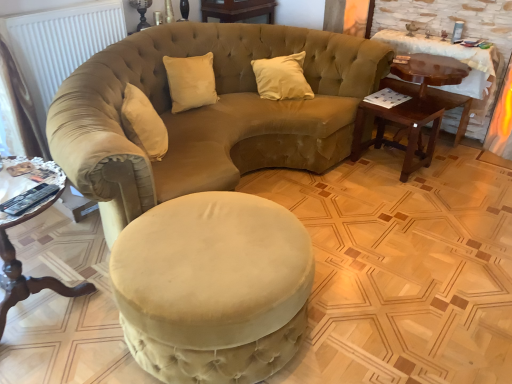
What do you see at coordinates (409, 122) in the screenshot? I see `dark brown wood side table at right, which appears as the 2th table when viewed from the back` at bounding box center [409, 122].

Locate an element on the screen. This screenshot has width=512, height=384. wooden round table at lower left, the 3th table from the back is located at coordinates (13, 246).

Image resolution: width=512 pixels, height=384 pixels. Identify the location of velvet beige studio couch at center. (208, 112).

This screenshot has width=512, height=384. What do you see at coordinates (208, 112) in the screenshot?
I see `velvet beige studio couch at center` at bounding box center [208, 112].

Identify the location of velvet beige ottoman at center. The width and height of the screenshot is (512, 384). (213, 287).

Would you say beige velvet pillow at center is outside velvet beige ottoman at center?

Indeed, beige velvet pillow at center is completely outside velvet beige ottoman at center.

Considering the relative sizes of beige velvet pillow at center and velvet beige ottoman at center in the image provided, is beige velvet pillow at center shorter than velvet beige ottoman at center?

Correct, beige velvet pillow at center is not as tall as velvet beige ottoman at center.

Is point (267, 94) in front of point (173, 218)?

No.

Can you tell me how much beige velvet pillow at center and velvet beige ottoman at center differ in facing direction?

144 degrees.

From a real-world perspective, which is physically below, white matte radiator at upper left or beige velvet pillow at center?

From a 3D spatial view, beige velvet pillow at center is below.

Which object is thinner, white matte radiator at upper left or beige velvet pillow at center?

With smaller width is white matte radiator at upper left.

Considering the relative sizes of white matte radiator at upper left and beige velvet pillow at center in the image provided, is white matte radiator at upper left smaller than beige velvet pillow at center?

No, white matte radiator at upper left is not smaller than beige velvet pillow at center.

Between white matte radiator at upper left and beige velvet pillow at center, which one is positioned behind?

beige velvet pillow at center is behind.

Find the location of a particular element. pillow above the velvet beige ottoman at center (from the image's perspective) is located at coordinates (282, 78).

Relative to beige velvet pillow at center, is velvet beige ottoman at center in front or behind?

velvet beige ottoman at center is positioned closer to the viewer than beige velvet pillow at center.

Is velvet beige ottoman at center not near beige velvet pillow at center?

Absolutely, velvet beige ottoman at center is distant from beige velvet pillow at center.

From a real-world perspective, which object rests below the other?

velvet beige ottoman at center, from a real-world perspective.

Identify the location of table that is the 1st one above the dark brown wood side table at right, which appears as the 2th table when viewed from the right (from a real-world perspective). This screenshot has height=384, width=512. (13, 246).

Is dark brown wood side table at right, the second table in the left-to-right sequence, surrounding wooden round table at lower left, which appears as the 1th table when viewed from the front?

That's incorrect, wooden round table at lower left, which appears as the 1th table when viewed from the front, is not inside dark brown wood side table at right, the second table in the left-to-right sequence.

Is dark brown wood side table at right, which appears as the 2th table when viewed from the back, far away from wooden round table at lower left, the 1th table when ordered from left to right?

That's right, there is a large distance between dark brown wood side table at right, which appears as the 2th table when viewed from the back, and wooden round table at lower left, the 1th table when ordered from left to right.

Which point is more distant from viewer, (x=0, y=26) or (x=244, y=216)?

The point (x=0, y=26) is behind.

Does white matte radiator at upper left have a smaller size compared to velvet beige ottoman at center?

Yes, white matte radiator at upper left is smaller than velvet beige ottoman at center.

Is white matte radiator at upper left next to velvet beige ottoman at center and touching it?

No, white matte radiator at upper left is not beside velvet beige ottoman at center.

Is white matte radiator at upper left facing away from velvet beige ottoman at center?

No.

Looking at their sizes, would you say mahogany wood side table at right, the third table from the front, is wider or thinner than velvet beige ottoman at center?

mahogany wood side table at right, the third table from the front, is thinner than velvet beige ottoman at center.

Which is behind, mahogany wood side table at right, the 3th table in the left-to-right sequence, or velvet beige ottoman at center?

mahogany wood side table at right, the 3th table in the left-to-right sequence.

Between mahogany wood side table at right, which is the 1th table in right-to-left order, and velvet beige ottoman at center, which one appears on the left side from the viewer's perspective?

velvet beige ottoman at center.

From a real-world perspective, which is physically above, mahogany wood side table at right, the 1th table positioned from the back, or velvet beige ottoman at center?

mahogany wood side table at right, the 1th table positioned from the back.

Based on their sizes in the image, would you say velvet beige studio couch at center is bigger or smaller than dark brown wood side table at right, which appears as the 2th table when viewed from the back?

In the image, velvet beige studio couch at center appears to be larger than dark brown wood side table at right, which appears as the 2th table when viewed from the back.

Is point (305, 152) in front of point (425, 108)?

Yes, it is in front of point (425, 108).

Looking at this image, which is in front, velvet beige studio couch at center or dark brown wood side table at right, which appears as the 2th table when viewed from the back?

velvet beige studio couch at center is more forward.

Which is more to the left, velvet beige studio couch at center or dark brown wood side table at right, which appears as the 2th table when viewed from the right?

velvet beige studio couch at center.

The image size is (512, 384). I want to click on swivel chair in front of the beige velvet pillow at center, so click(213, 287).

You are a GUI agent. You are given a task and a screenshot of the screen. Output one action in this format:
    pyautogui.click(x=<x>, y=<y>)
    Task: Click on the radiator on the left of the beige velvet pillow at center
    The width and height of the screenshot is (512, 384).
    Given the screenshot: What is the action you would take?
    pyautogui.click(x=55, y=52)

From the image, which object appears to be farther from velvet beige studio couch at center, dark brown wood side table at right, which appears as the 2th table when viewed from the right, or beige velvet pillow at center?

dark brown wood side table at right, which appears as the 2th table when viewed from the right, lies further to velvet beige studio couch at center than the other object.

Which object lies further to the anchor point velvet beige ottoman at center, white matte radiator at upper left or dark brown wood side table at right, which appears as the 2th table when viewed from the right?

dark brown wood side table at right, which appears as the 2th table when viewed from the right.

Looking at the image, which one is located closer to white matte radiator at upper left, mahogany wood side table at right, the third table from the front, or velvet beige ottoman at center?

velvet beige ottoman at center.

Based on the photo, estimate the real-world distances between objects in this image. Which object is closer to velvet beige studio couch at center, mahogany wood side table at right, which is the 1th table in right-to-left order, or wooden round table at lower left, the 1th table when ordered from left to right?

mahogany wood side table at right, which is the 1th table in right-to-left order, lies closer to velvet beige studio couch at center than the other object.

Based on their spatial positions, is dark brown wood side table at right, the 2th table when ordered from front to back, or mahogany wood side table at right, the 3th table in the left-to-right sequence, further from white matte radiator at upper left?

The object further to white matte radiator at upper left is mahogany wood side table at right, the 3th table in the left-to-right sequence.

Based on the photo, based on their spatial positions, is mahogany wood side table at right, which is the 1th table in right-to-left order, or white matte radiator at upper left closer to velvet beige ottoman at center?

white matte radiator at upper left is closer to velvet beige ottoman at center.

Looking at this image, estimate the real-world distances between objects in this image. Which object is further from beige velvet pillow at center, white matte radiator at upper left or mahogany wood side table at right, the third table from the front?

white matte radiator at upper left is further to beige velvet pillow at center.

Considering their positions, is mahogany wood side table at right, the 3th table in the left-to-right sequence, positioned further to velvet beige studio couch at center than velvet beige ottoman at center?

mahogany wood side table at right, the 3th table in the left-to-right sequence, is positioned further to the anchor velvet beige studio couch at center.

The width and height of the screenshot is (512, 384). In order to click on studio couch located between wooden round table at lower left, which ranks as the 3th table in right-to-left order, and dark brown wood side table at right, the second table in the left-to-right sequence, in the left-right direction in this screenshot , I will do `click(208, 112)`.

The width and height of the screenshot is (512, 384). In order to click on studio couch that lies between white matte radiator at upper left and wooden round table at lower left, which appears as the 1th table when viewed from the front, from top to bottom in this screenshot , I will do `click(208, 112)`.

Where is `pillow located between wooden round table at lower left, which ranks as the 3th table in right-to-left order, and mahogany wood side table at right, the 3th table in the left-to-right sequence, in the left-right direction`? This screenshot has width=512, height=384. pillow located between wooden round table at lower left, which ranks as the 3th table in right-to-left order, and mahogany wood side table at right, the 3th table in the left-to-right sequence, in the left-right direction is located at coordinates (282, 78).

In order to click on studio couch between wooden round table at lower left, the 1th table when ordered from left to right, and beige velvet pillow at center in the front-back direction in this screenshot , I will do `click(208, 112)`.